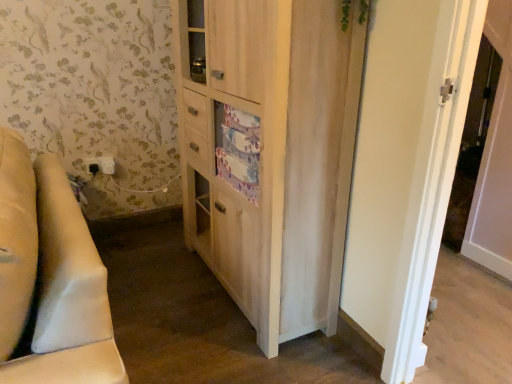
Question: Is green leafy plant at upper center at the right side of light wood cabinet at center?

Choices:
 (A) yes
 (B) no

Answer: (A)

Question: Is light wood cabinet at center located within green leafy plant at upper center?

Choices:
 (A) no
 (B) yes

Answer: (A)

Question: Is green leafy plant at upper center aimed at light wood cabinet at center?

Choices:
 (A) yes
 (B) no

Answer: (B)

Question: Does green leafy plant at upper center touch light wood cabinet at center?

Choices:
 (A) no
 (B) yes

Answer: (A)

Question: Considering the relative positions of green leafy plant at upper center and light wood cabinet at center in the image provided, is green leafy plant at upper center to the left of light wood cabinet at center from the viewer's perspective?

Choices:
 (A) yes
 (B) no

Answer: (B)

Question: Considering the positions of light wood cabinet at center and white plastic electric outlet at lower left in the image, is light wood cabinet at center wider or thinner than white plastic electric outlet at lower left?

Choices:
 (A) wide
 (B) thin

Answer: (A)

Question: From a real-world perspective, is light wood cabinet at center positioned above or below white plastic electric outlet at lower left?

Choices:
 (A) below
 (B) above

Answer: (B)

Question: Is light wood cabinet at center inside the boundaries of white plastic electric outlet at lower left, or outside?

Choices:
 (A) outside
 (B) inside

Answer: (A)

Question: Is point (181, 127) positioned closer to the camera than point (93, 170)?

Choices:
 (A) closer
 (B) farther

Answer: (A)

Question: In the image, is white plastic electric outlet at lower left positioned in front of or behind beige fabric couch at left?

Choices:
 (A) behind
 (B) front

Answer: (A)

Question: Would you say white plastic electric outlet at lower left is to the left or to the right of beige fabric couch at left in the picture?

Choices:
 (A) right
 (B) left

Answer: (B)

Question: Does point (109, 165) appear closer or farther from the camera than point (16, 332)?

Choices:
 (A) closer
 (B) farther

Answer: (B)

Question: Is white plastic electric outlet at lower left bigger or smaller than beige fabric couch at left?

Choices:
 (A) big
 (B) small

Answer: (B)

Question: In terms of size, does white plastic screen door at upper right appear bigger or smaller than beige fabric couch at left?

Choices:
 (A) small
 (B) big

Answer: (A)

Question: Which is correct: white plastic screen door at upper right is inside beige fabric couch at left, or outside of it?

Choices:
 (A) outside
 (B) inside

Answer: (A)